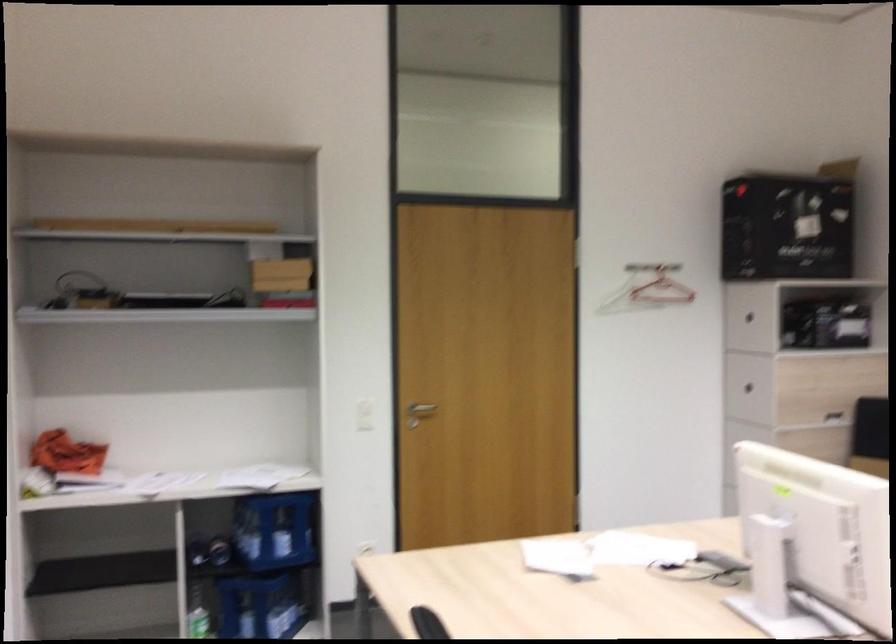
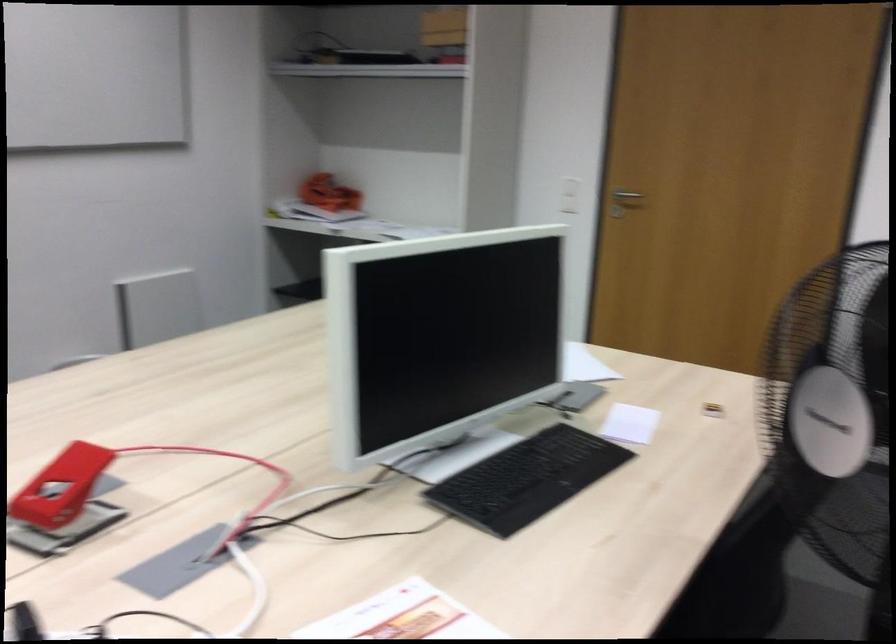
Find the pixel in the second image that matches [385,424] in the first image.

(624, 202)